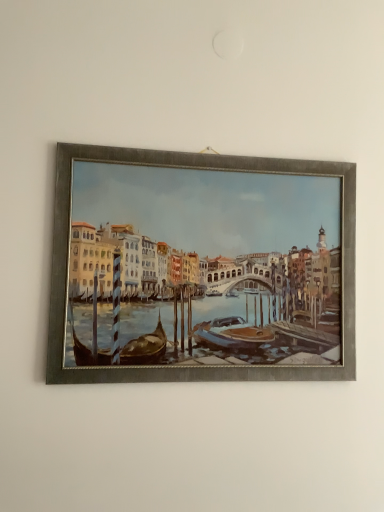
Locate an element on the screen. metallic silver frame at center is located at coordinates (199, 268).

Describe the element at coordinates (199, 268) in the screenshot. I see `metallic silver frame at center` at that location.

Identify the location of metallic silver frame at center. (199, 268).